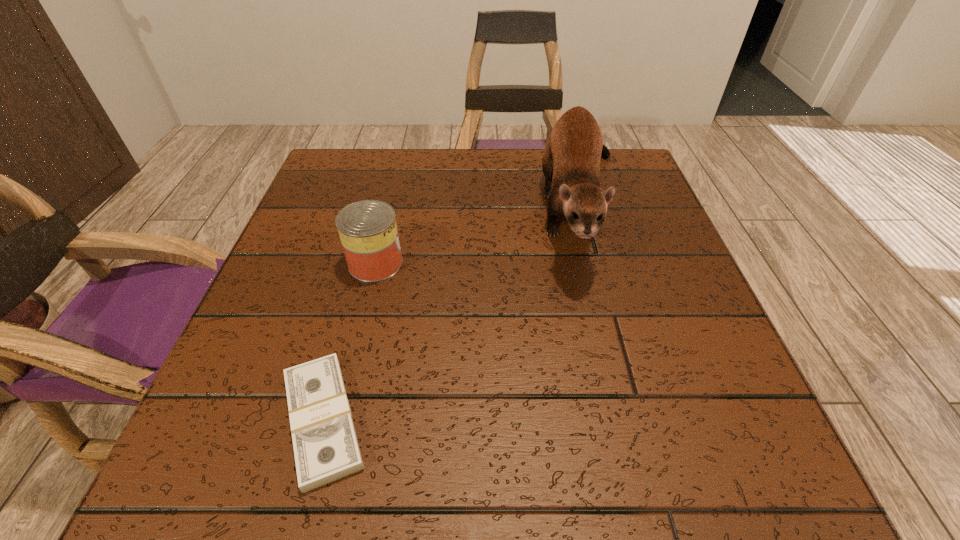
Locate an element on the screen. can located in the left edge section of the desktop is located at coordinates (367, 229).

At what (x,y) coordinates should I click in order to perform the action: click on dollar that is at the left edge. Please return your answer as a coordinate pair (x, y). This screenshot has width=960, height=540. Looking at the image, I should click on (326, 449).

Find the location of a particular element. This screenshot has width=960, height=540. object at the right edge is located at coordinates (571, 161).

Locate an element on the screen. object located at the near left corner is located at coordinates (326, 449).

You are a GUI agent. You are given a task and a screenshot of the screen. Output one action in this format:
    pyautogui.click(x=<x>, y=<y>)
    Task: Click on the object at the far right corner
    
    Given the screenshot: What is the action you would take?
    pyautogui.click(x=571, y=161)

The width and height of the screenshot is (960, 540). I want to click on free space at the far edge, so click(468, 183).

In the image, there is a desktop. Identify the location of vacant space at the near edge. The width and height of the screenshot is (960, 540). pos(541,440).

I want to click on free space at the left edge of the desktop, so click(x=316, y=293).

At what (x,y) coordinates should I click in order to perform the action: click on vacant area at the right edge of the desktop. Please return your answer as a coordinate pair (x, y). The image size is (960, 540). Looking at the image, I should click on (615, 316).

In the image, there is a desktop. What are the coordinates of `vacant space at the far left corner` in the screenshot? It's located at (358, 156).